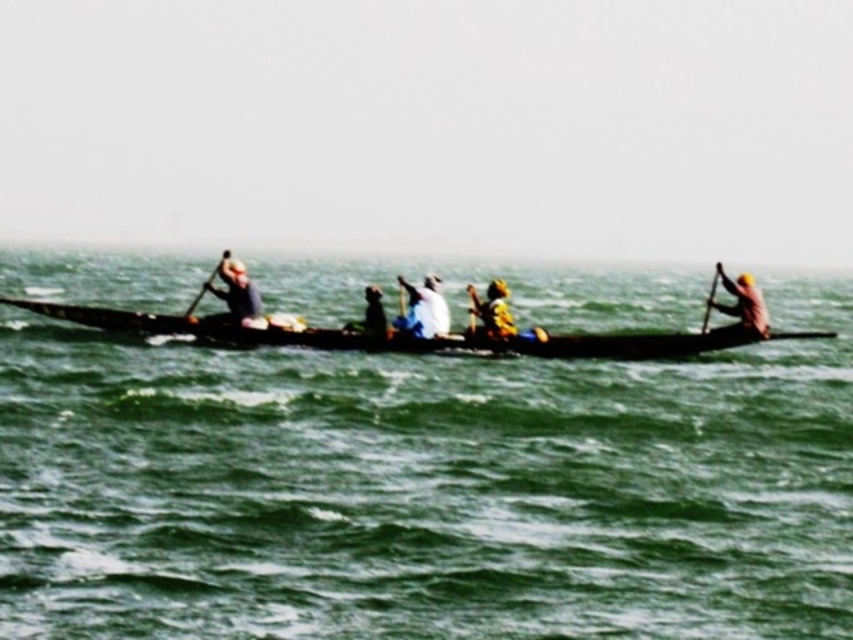
Question: Among these points, which one is nearest to the camera?

Choices:
 (A) (378, 320)
 (B) (842, 380)

Answer: (A)

Question: Is green water at center above white fabric at center?

Choices:
 (A) yes
 (B) no

Answer: (A)

Question: Can you confirm if white fabric at center is positioned below dark brown wooden paddle at right?

Choices:
 (A) no
 (B) yes

Answer: (A)

Question: Which of the following is the closest to the observer?

Choices:
 (A) dark blue fabric at left
 (B) dark brown wooden paddle at right
 (C) matte black shirt at center
 (D) wooden paddle at right

Answer: (C)

Question: Does wooden canoe at center have a larger size compared to dark brown wooden paddle at right?

Choices:
 (A) no
 (B) yes

Answer: (B)

Question: Which point is farther to the camera?

Choices:
 (A) dark blue fabric at left
 (B) wooden paddle at left
 (C) wooden paddle at right
 (D) dark brown wooden paddle at right

Answer: (C)